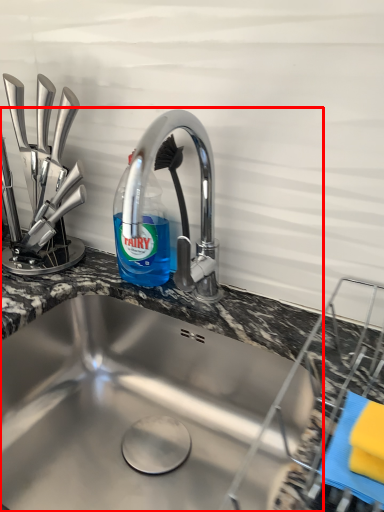
Question: Observing the image, what is the correct spatial positioning of sink (annotated by the red box) in reference to bottle?

Choices:
 (A) right
 (B) left

Answer: (A)